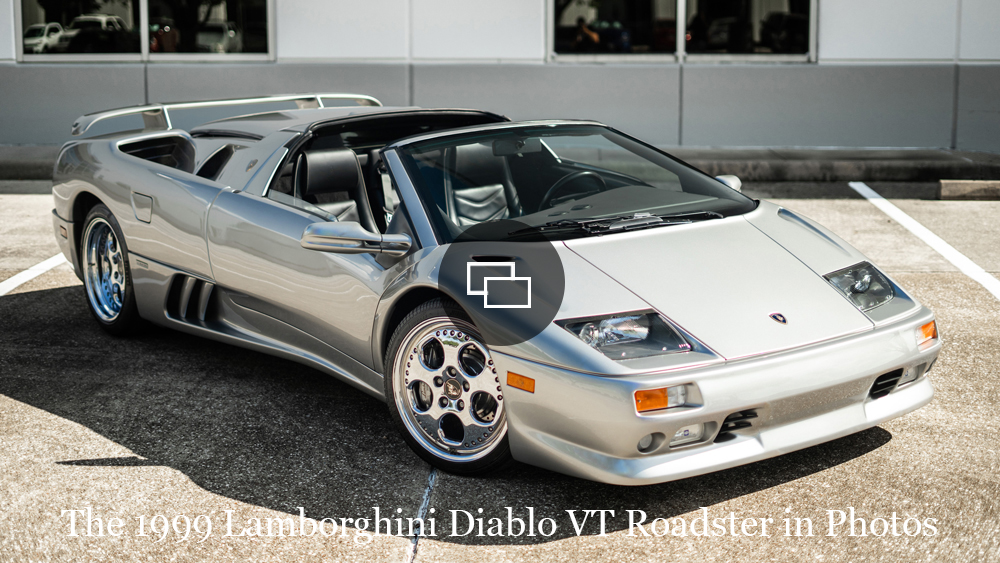
The image size is (1000, 563). I want to click on light, so click(x=686, y=436).